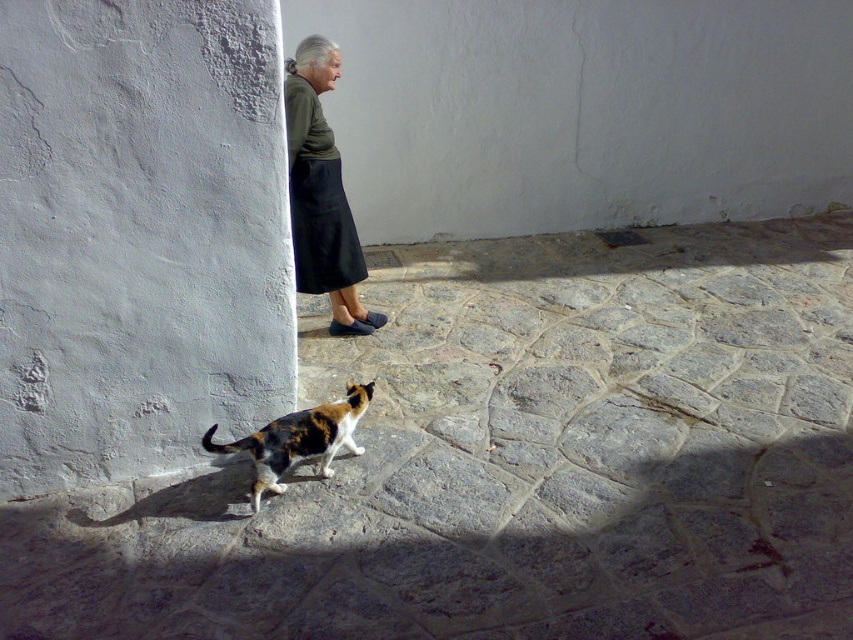
Based on the photo, does calico cat at lower center have a smaller size compared to calico fur cat at lower center?

Actually, calico cat at lower center might be larger than calico fur cat at lower center.

Does point (811, 342) lie behind point (361, 397)?

Yes, it is behind point (361, 397).

Locate an element on the screen. calico cat at lower center is located at coordinates (514, 461).

Consider the image. Which is above, dark green fabric skirt at upper center or calico fur cat at lower center?

Positioned higher is dark green fabric skirt at upper center.

Can you confirm if dark green fabric skirt at upper center is shorter than calico fur cat at lower center?

No.

Is point (305, 193) farther from viewer compared to point (271, 467)?

Yes.

Locate an element on the screen. The width and height of the screenshot is (853, 640). dark green fabric skirt at upper center is located at coordinates (321, 193).

Is point (326, 620) more distant than point (297, 232)?

No, it is not.

Between calico cat at lower center and dark green fabric skirt at upper center, which one is positioned higher?

dark green fabric skirt at upper center is higher up.

Consider the image. Who is more distant from viewer, (544,246) or (318,164)?

The point (544,246) is more distant.

Locate an element on the screen. This screenshot has height=640, width=853. calico cat at lower center is located at coordinates (514, 461).